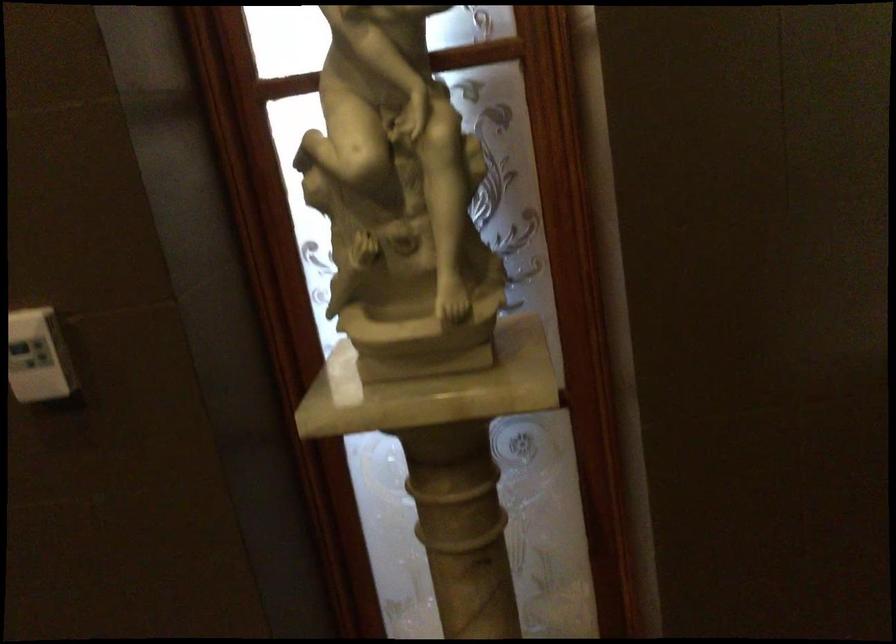
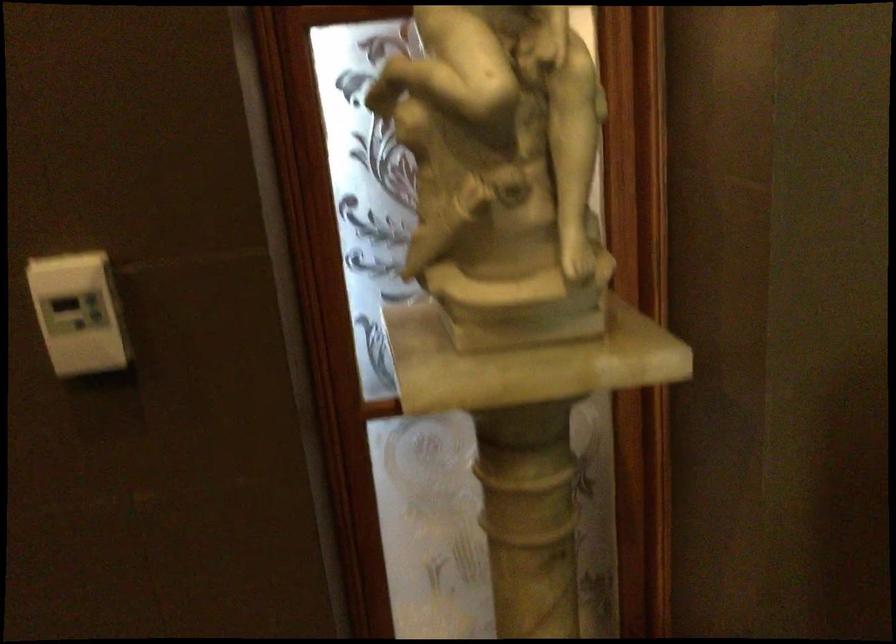
Where in the second image is the point corresponding to [389,228] from the first image?

(502, 172)